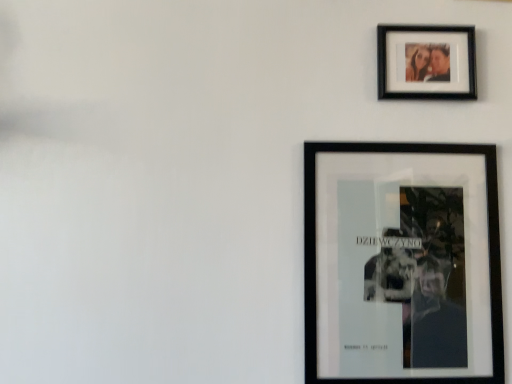
Image resolution: width=512 pixels, height=384 pixels. What are the coordinates of `black matte poster at lower right, positioned as the 2th picture frame in top-to-bottom order` in the screenshot? It's located at (402, 264).

The height and width of the screenshot is (384, 512). Describe the element at coordinates (402, 264) in the screenshot. I see `black matte poster at lower right, which ranks as the first picture frame in bottom-to-top order` at that location.

How much space does black matte poster at lower right, positioned as the 2th picture frame in top-to-bottom order, occupy vertically?

black matte poster at lower right, positioned as the 2th picture frame in top-to-bottom order, is 21.29 inches in height.

Consider the image. Measure the distance between black matte photo frame at upper right, the 1th picture frame viewed from the top, and camera.

black matte photo frame at upper right, the 1th picture frame viewed from the top, and camera are 37.97 inches apart.

This screenshot has height=384, width=512. What do you see at coordinates (426, 62) in the screenshot? I see `black matte photo frame at upper right, the 1th picture frame viewed from the top` at bounding box center [426, 62].

Where is `black matte photo frame at upper right, which is the 2th picture frame from bottom to top`? This screenshot has height=384, width=512. black matte photo frame at upper right, which is the 2th picture frame from bottom to top is located at coordinates (426, 62).

Identify the location of black matte poster at lower right, which ranks as the first picture frame in bottom-to-top order. (402, 264).

Considering the relative positions of black matte photo frame at upper right, which is the 2th picture frame from bottom to top, and black matte poster at lower right, positioned as the 2th picture frame in top-to-bottom order, in the image provided, is black matte photo frame at upper right, which is the 2th picture frame from bottom to top, to the right of black matte poster at lower right, positioned as the 2th picture frame in top-to-bottom order, from the viewer's perspective?

Yes.

Between black matte photo frame at upper right, the 1th picture frame viewed from the top, and black matte poster at lower right, positioned as the 2th picture frame in top-to-bottom order, which one is positioned behind?

Positioned behind is black matte photo frame at upper right, the 1th picture frame viewed from the top.

Considering the positions of points (448, 89) and (412, 307), is point (448, 89) farther from camera compared to point (412, 307)?

Yes, point (448, 89) is behind point (412, 307).

From the image's perspective, is black matte photo frame at upper right, the 1th picture frame viewed from the top, located beneath black matte poster at lower right, positioned as the 2th picture frame in top-to-bottom order?

No, from the image's perspective, black matte photo frame at upper right, the 1th picture frame viewed from the top, is not beneath black matte poster at lower right, positioned as the 2th picture frame in top-to-bottom order.

From a real-world perspective, who is located lower, black matte photo frame at upper right, which is the 2th picture frame from bottom to top, or black matte poster at lower right, which ranks as the first picture frame in bottom-to-top order?

From a 3D spatial view, black matte poster at lower right, which ranks as the first picture frame in bottom-to-top order, is below.

Considering the relative sizes of black matte photo frame at upper right, the 1th picture frame viewed from the top, and black matte poster at lower right, positioned as the 2th picture frame in top-to-bottom order, in the image provided, is black matte photo frame at upper right, the 1th picture frame viewed from the top, thinner than black matte poster at lower right, positioned as the 2th picture frame in top-to-bottom order,?

Correct, the width of black matte photo frame at upper right, the 1th picture frame viewed from the top, is less than that of black matte poster at lower right, positioned as the 2th picture frame in top-to-bottom order.

Considering the relative sizes of black matte photo frame at upper right, which is the 2th picture frame from bottom to top, and black matte poster at lower right, which ranks as the first picture frame in bottom-to-top order, in the image provided, is black matte photo frame at upper right, which is the 2th picture frame from bottom to top, taller than black matte poster at lower right, which ranks as the first picture frame in bottom-to-top order,?

No.

Does black matte photo frame at upper right, which is the 2th picture frame from bottom to top, have a smaller size compared to black matte poster at lower right, which ranks as the first picture frame in bottom-to-top order?

Yes.

Is black matte photo frame at upper right, the 1th picture frame viewed from the top, completely or partially outside of black matte poster at lower right, positioned as the 2th picture frame in top-to-bottom order?

black matte photo frame at upper right, the 1th picture frame viewed from the top, lies outside black matte poster at lower right, positioned as the 2th picture frame in top-to-bottom order,'s area.

Is black matte photo frame at upper right, the 1th picture frame viewed from the top, touching black matte poster at lower right, which ranks as the first picture frame in bottom-to-top order?

black matte photo frame at upper right, the 1th picture frame viewed from the top, and black matte poster at lower right, which ranks as the first picture frame in bottom-to-top order, are clearly separated.

Based on the photo, could you tell me if black matte photo frame at upper right, the 1th picture frame viewed from the top, is turned towards black matte poster at lower right, which ranks as the first picture frame in bottom-to-top order?

No, black matte photo frame at upper right, the 1th picture frame viewed from the top, does not turn towards black matte poster at lower right, which ranks as the first picture frame in bottom-to-top order.

Where is `picture frame that appears above the black matte poster at lower right, positioned as the 2th picture frame in top-to-bottom order (from a real-world perspective)`? The image size is (512, 384). picture frame that appears above the black matte poster at lower right, positioned as the 2th picture frame in top-to-bottom order (from a real-world perspective) is located at coordinates (426, 62).

Does black matte poster at lower right, positioned as the 2th picture frame in top-to-bottom order, appear on the left side of black matte photo frame at upper right, which is the 2th picture frame from bottom to top?

Yes, black matte poster at lower right, positioned as the 2th picture frame in top-to-bottom order, is to the left of black matte photo frame at upper right, which is the 2th picture frame from bottom to top.

Is the position of black matte poster at lower right, which ranks as the first picture frame in bottom-to-top order, less distant than that of black matte photo frame at upper right, the 1th picture frame viewed from the top?

Yes, it is in front of black matte photo frame at upper right, the 1th picture frame viewed from the top.

Does point (497, 308) come farther from viewer compared to point (421, 55)?

No, (497, 308) is closer to viewer.

From the image's perspective, would you say black matte poster at lower right, which ranks as the first picture frame in bottom-to-top order, is shown under black matte photo frame at upper right, the 1th picture frame viewed from the top?

Yes, from the image's perspective, black matte poster at lower right, which ranks as the first picture frame in bottom-to-top order, is below black matte photo frame at upper right, the 1th picture frame viewed from the top.

From a real-world perspective, between black matte poster at lower right, positioned as the 2th picture frame in top-to-bottom order, and black matte photo frame at upper right, which is the 2th picture frame from bottom to top, who is vertically higher?

black matte photo frame at upper right, which is the 2th picture frame from bottom to top, is physically above.

Considering the sizes of black matte poster at lower right, positioned as the 2th picture frame in top-to-bottom order, and black matte photo frame at upper right, which is the 2th picture frame from bottom to top, in the image, is black matte poster at lower right, positioned as the 2th picture frame in top-to-bottom order, wider or thinner than black matte photo frame at upper right, which is the 2th picture frame from bottom to top,?

Considering their sizes, black matte poster at lower right, positioned as the 2th picture frame in top-to-bottom order, looks broader than black matte photo frame at upper right, which is the 2th picture frame from bottom to top.

Based on the photo, does black matte poster at lower right, positioned as the 2th picture frame in top-to-bottom order, have a greater height compared to black matte photo frame at upper right, which is the 2th picture frame from bottom to top?

Indeed, black matte poster at lower right, positioned as the 2th picture frame in top-to-bottom order, has a greater height compared to black matte photo frame at upper right, which is the 2th picture frame from bottom to top.

In the scene shown: Looking at the image, does black matte poster at lower right, which ranks as the first picture frame in bottom-to-top order, seem bigger or smaller compared to black matte photo frame at upper right, the 1th picture frame viewed from the top?

In the image, black matte poster at lower right, which ranks as the first picture frame in bottom-to-top order, appears to be larger than black matte photo frame at upper right, the 1th picture frame viewed from the top.

Could black matte photo frame at upper right, which is the 2th picture frame from bottom to top, be considered to be inside black matte poster at lower right, positioned as the 2th picture frame in top-to-bottom order?

No, black matte photo frame at upper right, which is the 2th picture frame from bottom to top, is not a part of black matte poster at lower right, positioned as the 2th picture frame in top-to-bottom order.

Is black matte poster at lower right, which ranks as the first picture frame in bottom-to-top order, positioned far away from black matte photo frame at upper right, which is the 2th picture frame from bottom to top?

black matte poster at lower right, which ranks as the first picture frame in bottom-to-top order, is actually quite close to black matte photo frame at upper right, which is the 2th picture frame from bottom to top.

Is black matte poster at lower right, which ranks as the first picture frame in bottom-to-top order, turned away from black matte photo frame at upper right, the 1th picture frame viewed from the top?

No, black matte poster at lower right, which ranks as the first picture frame in bottom-to-top order, is not facing the opposite direction of black matte photo frame at upper right, the 1th picture frame viewed from the top.

Where is `picture frame located on the right of black matte poster at lower right, which ranks as the first picture frame in bottom-to-top order`? The height and width of the screenshot is (384, 512). picture frame located on the right of black matte poster at lower right, which ranks as the first picture frame in bottom-to-top order is located at coordinates (426, 62).

Where is `picture frame located on the right of black matte poster at lower right, which ranks as the first picture frame in bottom-to-top order`? picture frame located on the right of black matte poster at lower right, which ranks as the first picture frame in bottom-to-top order is located at coordinates (426, 62).

Identify the location of picture frame below the black matte photo frame at upper right, the 1th picture frame viewed from the top (from the image's perspective). (402, 264).